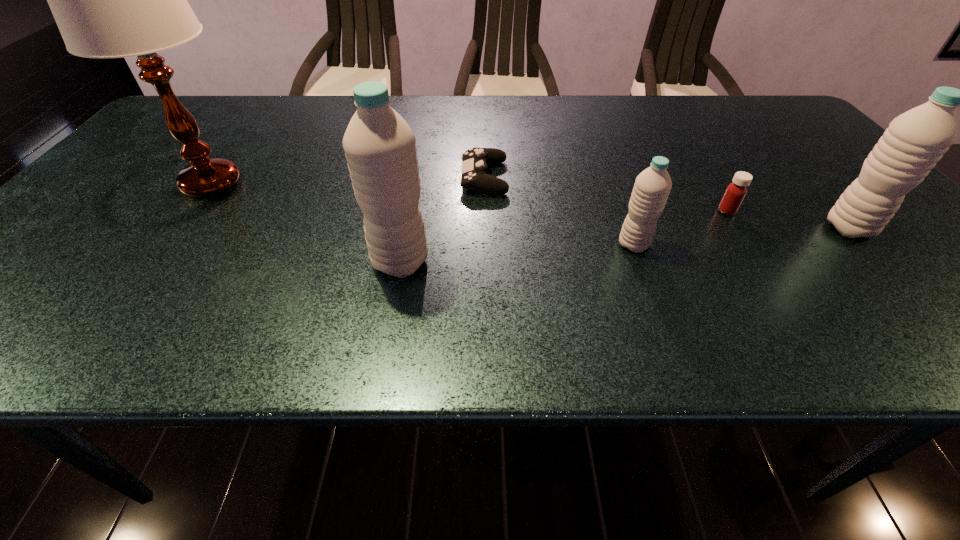
Select which water bottle is the closest to the medicine. Please provide its 2D coordinates. Your answer should be formatted as a tuple, i.e. [(x, y)], where the tuple contains the x and y coordinates of a point satisfying the conditions above.

[(916, 140)]

Find the location of `free space that satisfies the following two spatial constraints: 1. on the surface of the control; 2. on the front side of the table lamp`. free space that satisfies the following two spatial constraints: 1. on the surface of the control; 2. on the front side of the table lamp is located at coordinates (484, 184).

Identify the location of vacant space that satisfies the following two spatial constraints: 1. on the surface of the control; 2. on the left side of the medicine. (485, 211).